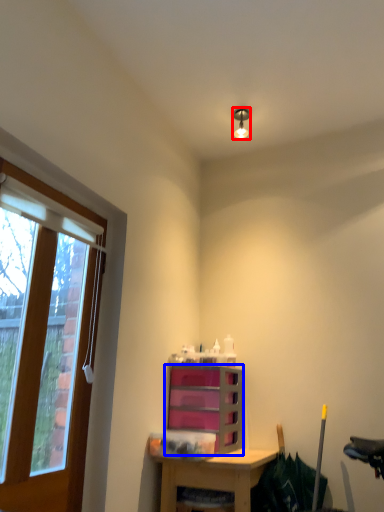
Question: Which object is closer to the camera taking this photo, light fixture (highlighted by a red box) or cabinetry (highlighted by a blue box)?

Choices:
 (A) light fixture
 (B) cabinetry

Answer: (B)